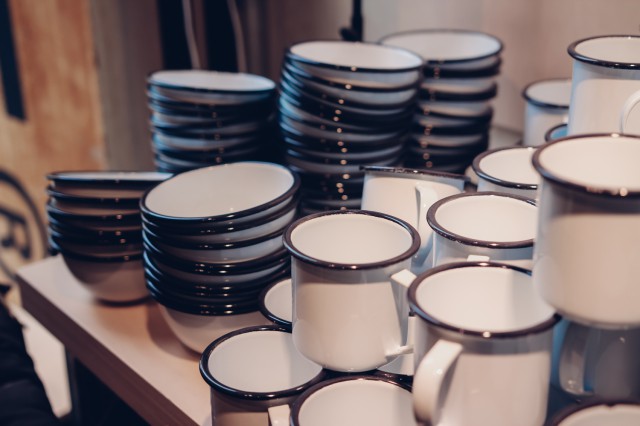
Find the location of a particular element. The image size is (640, 426). bowls on left is located at coordinates (125, 257), (122, 241), (118, 233), (118, 216), (116, 200), (116, 182).